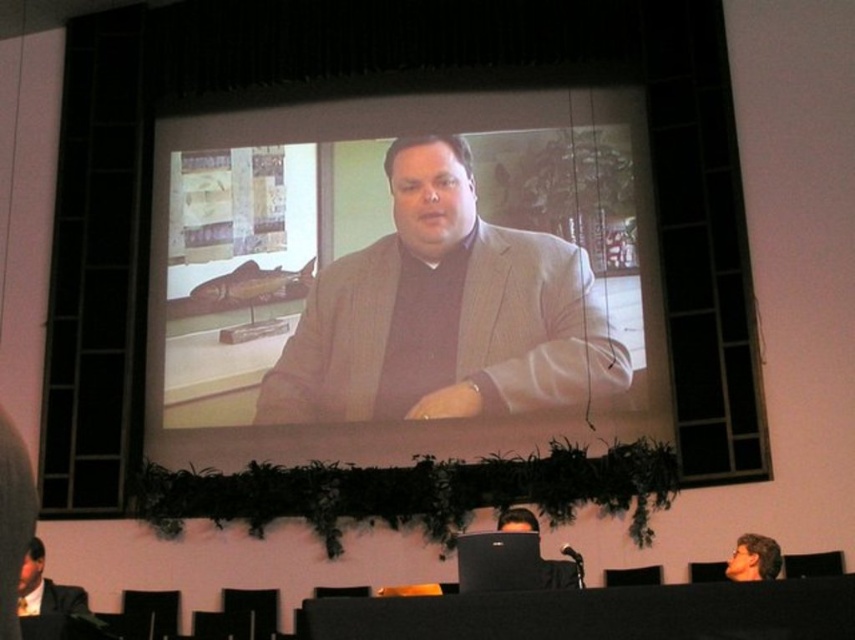
Question: Which point appears farthest from the camera in this image?

Choices:
 (A) (57, 584)
 (B) (658, 609)
 (C) (732, 568)
 (D) (429, 236)

Answer: (D)

Question: From the image, what is the correct spatial relationship of matte black suit at lower left in relation to smooth brown hair at lower right?

Choices:
 (A) left
 (B) right

Answer: (A)

Question: Considering the relative positions of black fabric table at lower center and smooth brown hair at lower right in the image provided, where is black fabric table at lower center located with respect to smooth brown hair at lower right?

Choices:
 (A) right
 (B) left

Answer: (B)

Question: Which of these objects is positioned closest to the smooth brown hair at lower right?

Choices:
 (A) matte black suit at lower left
 (B) black fabric table at lower center
 (C) matte gray suit at center

Answer: (B)

Question: Estimate the real-world distances between objects in this image. Which object is farther from the matte black suit at lower left?

Choices:
 (A) smooth brown hair at lower right
 (B) black fabric table at lower center

Answer: (A)

Question: Does black fabric table at lower center appear on the right side of matte black suit at lower left?

Choices:
 (A) yes
 (B) no

Answer: (A)